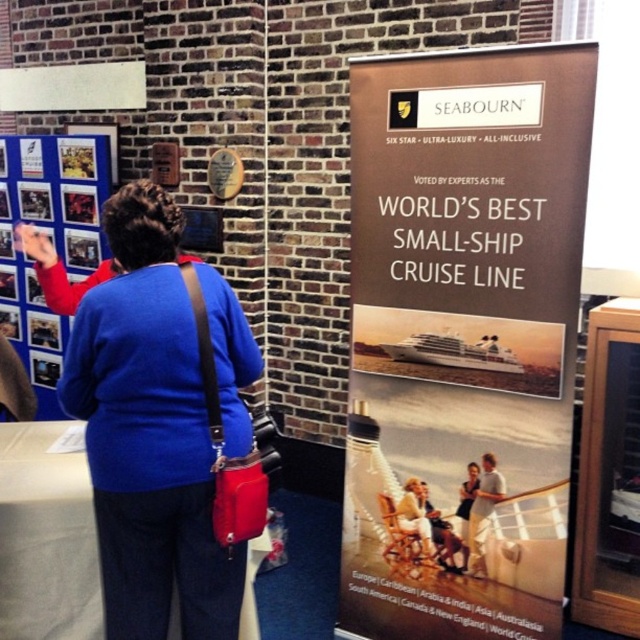
Can you confirm if light brown leather jacket at center is positioned to the right of light brown leather chair at center?

Correct, you'll find light brown leather jacket at center to the right of light brown leather chair at center.

Describe the element at coordinates (483, 513) in the screenshot. The width and height of the screenshot is (640, 640). I see `light brown leather jacket at center` at that location.

At what (x,y) coordinates should I click in order to perform the action: click on light brown leather jacket at center. Please return your answer as a coordinate pair (x, y). The height and width of the screenshot is (640, 640). Looking at the image, I should click on (483, 513).

Does blue fabric sweater at upper left have a lesser height compared to light brown leather chair at center?

In fact, blue fabric sweater at upper left may be taller than light brown leather chair at center.

Can you confirm if blue fabric sweater at upper left is positioned above light brown leather chair at center?

Yes.

Does point (147, 486) lie in front of point (422, 506)?

Yes, point (147, 486) is closer to viewer.

Locate an element on the screen. blue fabric sweater at upper left is located at coordinates (148, 433).

Does brown cardboard poster at right have a greater width compared to light brown leather chair at center?

Correct, the width of brown cardboard poster at right exceeds that of light brown leather chair at center.

Which is above, brown cardboard poster at right or light brown leather chair at center?

brown cardboard poster at right is above.

Does point (579, 113) come behind point (419, 536)?

No, (579, 113) is closer to viewer.

At what (x,y) coordinates should I click in order to perform the action: click on brown cardboard poster at right. Please return your answer as a coordinate pair (x, y). This screenshot has height=640, width=640. Looking at the image, I should click on (464, 332).